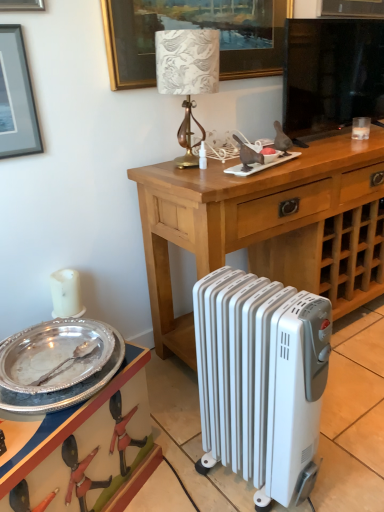
Locate an element on the screen. black glass television at upper center is located at coordinates (331, 73).

Describe the element at coordinates (16, 98) in the screenshot. I see `matte black picture frame at upper left, which is the second picture frame in back-to-front order` at that location.

This screenshot has width=384, height=512. Describe the element at coordinates (261, 379) in the screenshot. I see `white metallic radiator at lower center` at that location.

You are a GUI agent. You are given a task and a screenshot of the screen. Output one action in this format:
    pyautogui.click(x=<x>, y=<y>)
    Task: Click on the gold metallic lampshade at center
    The height and width of the screenshot is (512, 384).
    Given the screenshot: What is the action you would take?
    pyautogui.click(x=187, y=76)

The height and width of the screenshot is (512, 384). I want to click on silver/golden picture frame at upper center, which is the first picture frame in right-to-left order, so tap(195, 27).

Does wooden desk at center have a greater height compared to black glass television at upper center?

Indeed, wooden desk at center has a greater height compared to black glass television at upper center.

This screenshot has width=384, height=512. Identify the location of desk that appears in front of the black glass television at upper center. (269, 227).

Between wooden desk at center and black glass television at upper center, which one has larger width?

Wider between the two is wooden desk at center.

From a real-world perspective, between wooden desk at center and black glass television at upper center, who is vertically lower?

wooden desk at center, from a real-world perspective.

In the scene shown: Does silver metallic tray at lower left appear on the right side of black glass television at upper center?

In fact, silver metallic tray at lower left is to the left of black glass television at upper center.

Is black glass television at upper center at the back of silver metallic tray at lower left?

No, silver metallic tray at lower left is not facing away from black glass television at upper center.

From a real-world perspective, is silver metallic tray at lower left positioned over black glass television at upper center based on gravity?

Incorrect, from a real-world perspective, silver metallic tray at lower left is lower than black glass television at upper center.

Which object is closer to the camera taking this photo, silver metallic tray at lower left or black glass television at upper center?

silver metallic tray at lower left is in front.

Is silver metallic tray at lower left positioned behind silver/golden picture frame at upper center, which is the first picture frame from top to bottom?

No.

Find the location of a particular element. The height and width of the screenshot is (512, 384). picture frame that is the 2nd one when counting upward from the silver metallic tray at lower left (from the image's perspective) is located at coordinates (195, 27).

In the scene shown: Can you tell me how much silver metallic tray at lower left and silver/golden picture frame at upper center, which is the first picture frame from top to bottom, differ in facing direction?

The facing directions of silver metallic tray at lower left and silver/golden picture frame at upper center, which is the first picture frame from top to bottom, are 23.7 degrees apart.

From the image's perspective, is silver metallic tray at lower left located above silver/golden picture frame at upper center, which appears as the 2th picture frame when ordered from the bottom?

Incorrect, from the image's perspective, silver metallic tray at lower left is lower than silver/golden picture frame at upper center, which appears as the 2th picture frame when ordered from the bottom.

What's the angular difference between silver metallic tray at lower left and gold metallic lampshade at center's facing directions?

The angle between the facing direction of silver metallic tray at lower left and the facing direction of gold metallic lampshade at center is 20.7 degrees.

Would you consider silver metallic tray at lower left to be distant from gold metallic lampshade at center?

Yes, silver metallic tray at lower left and gold metallic lampshade at center are located far from each other.

From the picture: Is silver metallic tray at lower left taller or shorter than gold metallic lampshade at center?

Clearly, silver metallic tray at lower left is taller compared to gold metallic lampshade at center.

Is silver metallic tray at lower left to the left of gold metallic lampshade at center from the viewer's perspective?

Indeed, silver metallic tray at lower left is positioned on the left side of gold metallic lampshade at center.

Can you confirm if silver/golden picture frame at upper center, marked as the second picture frame in a front-to-back arrangement, is positioned to the left of black glass television at upper center?

Correct, you'll find silver/golden picture frame at upper center, marked as the second picture frame in a front-to-back arrangement, to the left of black glass television at upper center.

Is silver/golden picture frame at upper center, which appears as the 1th picture frame when viewed from the back, oriented towards black glass television at upper center?

No.

Is black glass television at upper center located within silver/golden picture frame at upper center, marked as the second picture frame in a front-to-back arrangement?

No, black glass television at upper center is not a part of silver/golden picture frame at upper center, marked as the second picture frame in a front-to-back arrangement.

From a real-world perspective, is silver/golden picture frame at upper center, which is the first picture frame from top to bottom, positioned under black glass television at upper center based on gravity?

Incorrect, from a real-world perspective, silver/golden picture frame at upper center, which is the first picture frame from top to bottom, is higher than black glass television at upper center.

Which object is closer to the camera, white metallic radiator at lower center or silver/glossy plate at lower left?

white metallic radiator at lower center.

Is white metallic radiator at lower center taller than silver/glossy plate at lower left?

Yes, white metallic radiator at lower center is taller than silver/glossy plate at lower left.

Find the location of a particular element. This screenshot has height=512, width=384. radiator that is in front of the silver/glossy plate at lower left is located at coordinates (261, 379).

Can you confirm if white metallic radiator at lower center is taller than wooden desk at center?

No, white metallic radiator at lower center is not taller than wooden desk at center.

Does point (194, 324) come behind point (150, 251)?

No, it is in front of (150, 251).

Based on the photo, considering the sizes of objects white metallic radiator at lower center and wooden desk at center in the image provided, who is bigger, white metallic radiator at lower center or wooden desk at center?

wooden desk at center.

Identify the location of desk on the right of black glass television at upper center. The image size is (384, 512). (269, 227).

The image size is (384, 512). Identify the location of vanity on the left of the black glass television at upper center. (84, 443).

Estimate the real-world distances between objects in this image. Which object is closer to silver/glossy plate at lower left, gold metallic lampshade at center or white metallic radiator at lower center?

white metallic radiator at lower center lies closer to silver/glossy plate at lower left than the other object.

Estimate the real-world distances between objects in this image. Which object is closer to matte black picture frame at upper left, marked as the first picture frame in a bottom-to-top arrangement, silver metallic tray at lower left or wooden desk at center?

wooden desk at center is closer to matte black picture frame at upper left, marked as the first picture frame in a bottom-to-top arrangement.

Which object lies further to the anchor point silver/golden picture frame at upper center, which appears as the 1th picture frame when viewed from the back, silver/glossy plate at lower left or matte black picture frame at upper left, the first picture frame when ordered from front to back?

The object further to silver/golden picture frame at upper center, which appears as the 1th picture frame when viewed from the back, is silver/glossy plate at lower left.

Estimate the real-world distances between objects in this image. Which object is closer to wooden desk at center, silver/glossy plate at lower left or silver/golden picture frame at upper center, which appears as the 2th picture frame when ordered from the bottom?

The object closer to wooden desk at center is silver/golden picture frame at upper center, which appears as the 2th picture frame when ordered from the bottom.

From the image, which object appears to be farther from silver/glossy plate at lower left, matte black picture frame at upper left, the second picture frame viewed from the right, or silver metallic tray at lower left?

The object further to silver/glossy plate at lower left is matte black picture frame at upper left, the second picture frame viewed from the right.

Based on their spatial positions, is white metallic radiator at lower center or black glass television at upper center closer to silver metallic tray at lower left?

The object closer to silver metallic tray at lower left is white metallic radiator at lower center.

When comparing their distances from matte black picture frame at upper left, which is the second picture frame in back-to-front order, does white metallic radiator at lower center or wooden desk at center seem closer?

Among the two, wooden desk at center is located nearer to matte black picture frame at upper left, which is the second picture frame in back-to-front order.

Which object lies nearer to the anchor point silver/glossy plate at lower left, matte black picture frame at upper left, the first picture frame when ordered from front to back, or gold metallic lampshade at center?

matte black picture frame at upper left, the first picture frame when ordered from front to back.

Where is `plate that lies between matte black picture frame at upper left, which is the second picture frame in back-to-front order, and white metallic radiator at lower center from top to bottom`? The height and width of the screenshot is (512, 384). plate that lies between matte black picture frame at upper left, which is the second picture frame in back-to-front order, and white metallic radiator at lower center from top to bottom is located at coordinates (57, 364).

I want to click on radiator between silver/glossy plate at lower left and wooden desk at center in the horizontal direction, so click(261, 379).

Locate an element on the screen. plate between matte black picture frame at upper left, the second picture frame viewed from the right, and silver metallic tray at lower left vertically is located at coordinates (57, 364).

Locate an element on the screen. The height and width of the screenshot is (512, 384). desk between silver/golden picture frame at upper center, which is the first picture frame from top to bottom, and silver/glossy plate at lower left from top to bottom is located at coordinates (269, 227).